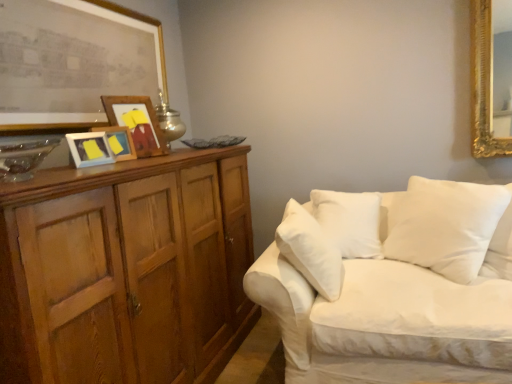
Question: Does wooden picture frame at left, the second picture frame when ordered from front to back, appear on the left side of metallic silver table lamp at upper left?

Choices:
 (A) no
 (B) yes

Answer: (B)

Question: From a real-world perspective, is wooden picture frame at left, the second picture frame when ordered from front to back, on top of metallic silver table lamp at upper left?

Choices:
 (A) yes
 (B) no

Answer: (B)

Question: Could you tell me if wooden picture frame at left, placed as the 3th picture frame when sorted from back to front, is turned towards metallic silver table lamp at upper left?

Choices:
 (A) no
 (B) yes

Answer: (A)

Question: Is the position of wooden picture frame at left, the second picture frame when ordered from front to back, more distant than that of metallic silver table lamp at upper left?

Choices:
 (A) no
 (B) yes

Answer: (A)

Question: Is metallic silver table lamp at upper left at the back of wooden picture frame at left, the second picture frame when ordered from front to back?

Choices:
 (A) no
 (B) yes

Answer: (A)

Question: Is white fabric couch at right inside the boundaries of wooden picture frame at upper left, which is counted as the first picture frame, starting from the front, or outside?

Choices:
 (A) inside
 (B) outside

Answer: (B)

Question: From the image's perspective, is white fabric couch at right located above or below wooden picture frame at upper left, the fourth picture frame in the back-to-front sequence?

Choices:
 (A) above
 (B) below

Answer: (B)

Question: Considering the positions of white fabric couch at right and wooden picture frame at upper left, which is counted as the first picture frame, starting from the front, in the image, is white fabric couch at right taller or shorter than wooden picture frame at upper left, which is counted as the first picture frame, starting from the front,?

Choices:
 (A) short
 (B) tall

Answer: (B)

Question: Based on their positions, is white fabric couch at right located to the left or right of wooden picture frame at upper left, which is counted as the first picture frame, starting from the front?

Choices:
 (A) right
 (B) left

Answer: (A)

Question: Looking at the image, does metallic silver table lamp at upper left seem bigger or smaller compared to wooden picture frame at left, placed as the 3th picture frame when sorted from back to front?

Choices:
 (A) big
 (B) small

Answer: (A)

Question: From the image's perspective, relative to wooden picture frame at left, placed as the 3th picture frame when sorted from back to front, is metallic silver table lamp at upper left above or below?

Choices:
 (A) above
 (B) below

Answer: (A)

Question: From a real-world perspective, is metallic silver table lamp at upper left above or below wooden picture frame at left, placed as the 3th picture frame when sorted from back to front?

Choices:
 (A) below
 (B) above

Answer: (B)

Question: Is metallic silver table lamp at upper left in front of or behind wooden picture frame at left, the second picture frame when ordered from front to back, in the image?

Choices:
 (A) front
 (B) behind

Answer: (B)

Question: Is wooden picture frame at upper left, which is the 4th picture frame in front-to-back order, in front of or behind yellow paper at center, the third picture frame from the front, in the image?

Choices:
 (A) behind
 (B) front

Answer: (A)

Question: From a real-world perspective, is wooden picture frame at upper left, which appears as the 1th picture frame when viewed from the back, physically located above or below yellow paper at center, the third picture frame from the front?

Choices:
 (A) below
 (B) above

Answer: (B)